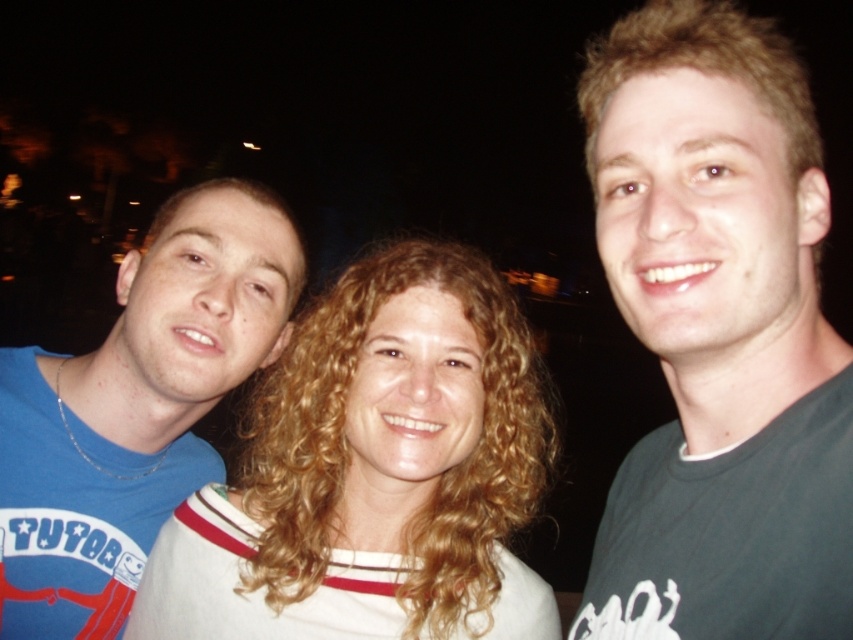
You are a photographer adjusting the focus of your camera. You need to ensure that the curly blonde hair at center is in sharp focus. Given that the camera can only focus precisely on objects within a 0.1 unit radius around the point you select, would the current focus point at point (x=375, y=472) be sufficient to capture the curly blonde hair at center clearly?

Yes, the focus point at (x=375, y=472) is exactly where the curly blonde hair at center is marked, so it will be in sharp focus.